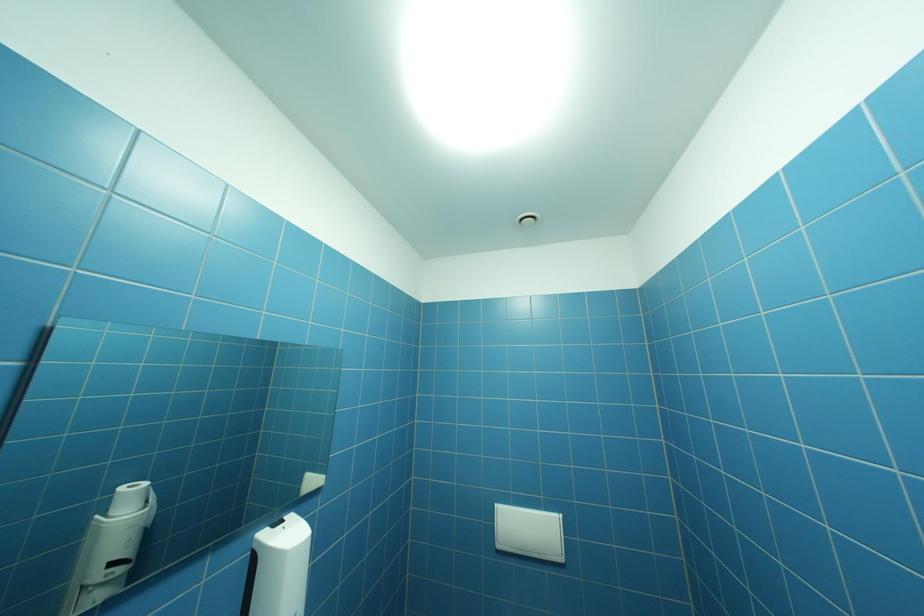
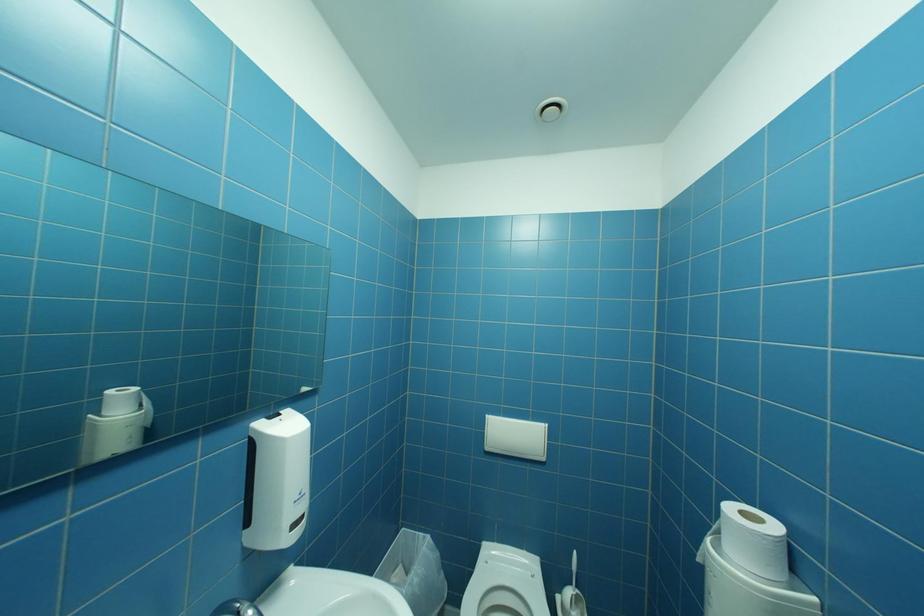
Question: The images are taken continuously from a first-person perspective. In which direction is your viewpoint rotating?

Choices:
 (A) Left
 (B) Right
 (C) Up
 (D) Down

Answer: (D)